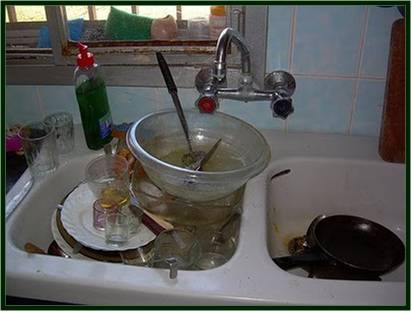
The width and height of the screenshot is (412, 312). Find the location of `right side of sink`. right side of sink is located at coordinates (287, 238).